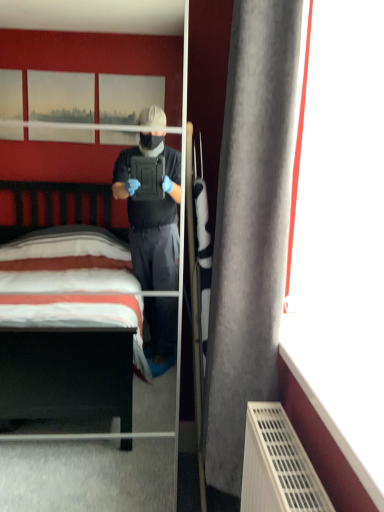
Question: Is clear glass mirror at center taller or shorter than gray fabric curtain at right?

Choices:
 (A) tall
 (B) short

Answer: (A)

Question: Considering the positions of clear glass mirror at center and gray fabric curtain at right in the image, is clear glass mirror at center wider or thinner than gray fabric curtain at right?

Choices:
 (A) thin
 (B) wide

Answer: (B)

Question: From a real-world perspective, is clear glass mirror at center above or below gray fabric curtain at right?

Choices:
 (A) below
 (B) above

Answer: (A)

Question: Considering their positions, is gray fabric curtain at right located in front of or behind clear glass mirror at center?

Choices:
 (A) front
 (B) behind

Answer: (A)

Question: From a real-world perspective, is gray fabric curtain at right physically located above or below clear glass mirror at center?

Choices:
 (A) below
 (B) above

Answer: (B)

Question: Is gray fabric curtain at right situated inside clear glass mirror at center or outside?

Choices:
 (A) inside
 (B) outside

Answer: (B)

Question: Considering the positions of gray fabric curtain at right and clear glass mirror at center in the image, is gray fabric curtain at right wider or thinner than clear glass mirror at center?

Choices:
 (A) wide
 (B) thin

Answer: (B)